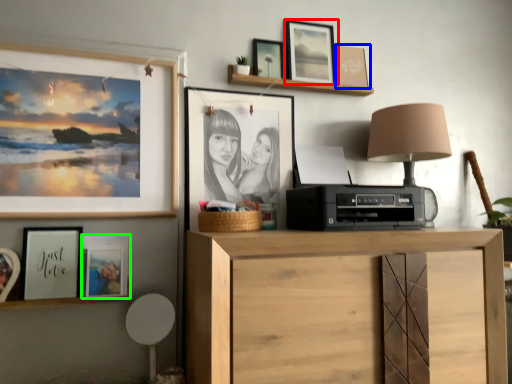
Question: Estimate the real-world distances between objects in this image. Which object is closer to picture frame (highlighted by a red box), picture frame (highlighted by a blue box) or picture frame (highlighted by a green box)?

Choices:
 (A) picture frame
 (B) picture frame

Answer: (A)